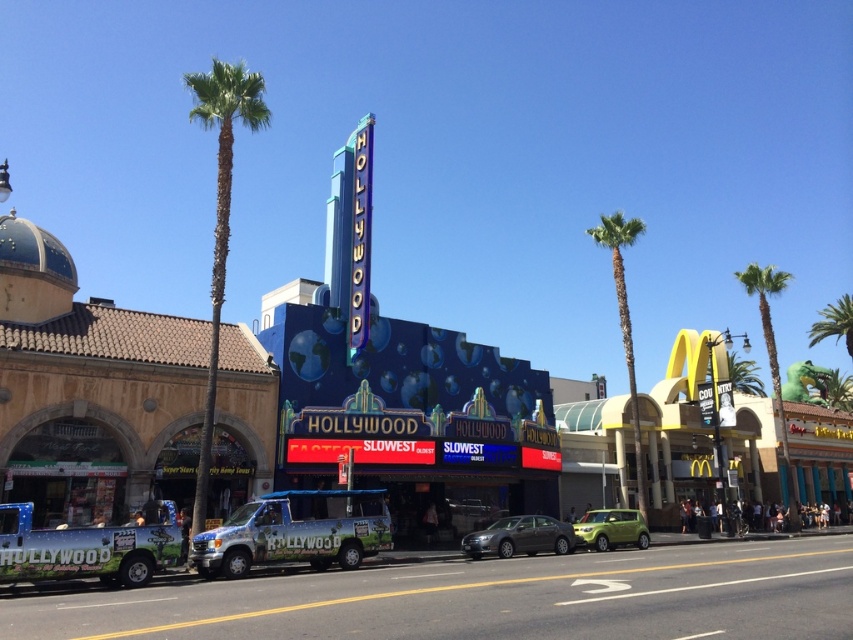
Question: Which object is closer to the camera taking this photo?

Choices:
 (A) green leafy palm tree at left
 (B) white glossy van at center

Answer: (B)

Question: Is satin silver sedan at center smaller than green leafy palm tree at right?

Choices:
 (A) yes
 (B) no

Answer: (A)

Question: From the image, what is the correct spatial relationship of white glossy van at center in relation to green leafy palm tree at right?

Choices:
 (A) below
 (B) above

Answer: (A)

Question: Which object is closer to the camera taking this photo?

Choices:
 (A) green leafy palm tree at center
 (B) satin silver sedan at center
 (C) blue glossy theater at center

Answer: (C)

Question: Based on their relative distances, which object is farther from the white glossy van at center?

Choices:
 (A) satin silver sedan at center
 (B) green leafy palm tree at center

Answer: (B)

Question: Can you confirm if satin silver sedan at center is wider than green matte car at lower right?

Choices:
 (A) no
 (B) yes

Answer: (A)